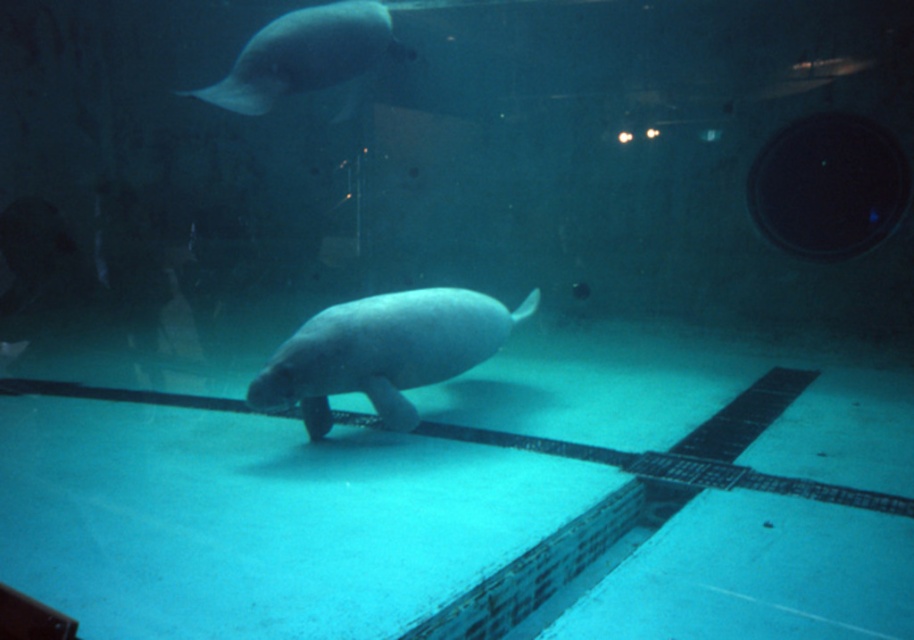
Question: Which point is closer to the camera?

Choices:
 (A) (194, 96)
 (B) (388, 321)

Answer: (A)

Question: Is gray matte manatee at center closer to the viewer compared to smooth gray fish at upper left?

Choices:
 (A) yes
 (B) no

Answer: (A)

Question: Which of the following is the farthest from the observer?

Choices:
 (A) (264, 45)
 (B) (415, 364)

Answer: (A)

Question: Can you confirm if gray matte manatee at center is positioned above smooth gray fish at upper left?

Choices:
 (A) no
 (B) yes

Answer: (A)

Question: Can you confirm if gray matte manatee at center is positioned to the right of smooth gray fish at upper left?

Choices:
 (A) yes
 (B) no

Answer: (A)